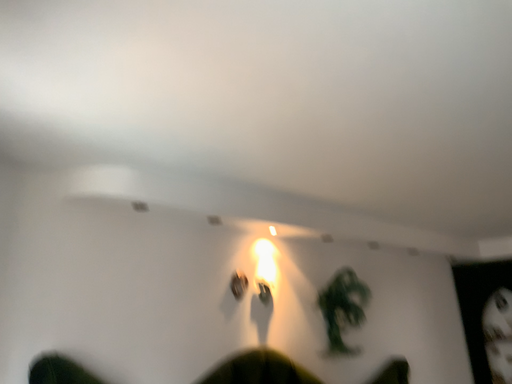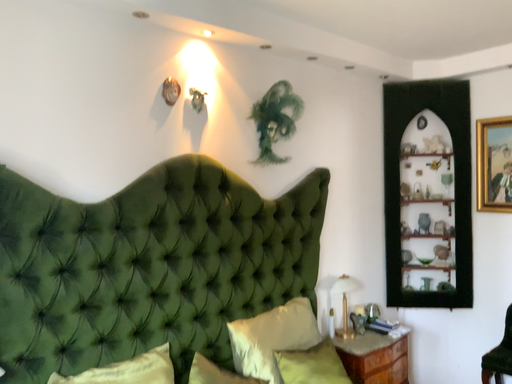
Question: How did the camera likely rotate when shooting the video?

Choices:
 (A) rotated downward
 (B) rotated upward

Answer: (A)